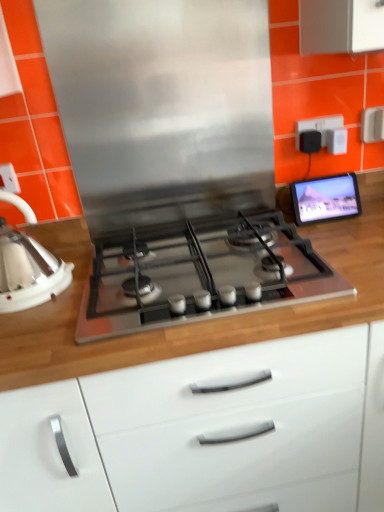
Identify the location of matte black tablet at upper right. The height and width of the screenshot is (512, 384). pos(326,199).

Measure the distance between point (x=304, y=218) and camera.

1.26 meters.

Describe the element at coordinates (191, 323) in the screenshot. I see `wooden countertop at center` at that location.

Find the location of `white glossy kettle at left`. white glossy kettle at left is located at coordinates (28, 271).

Measure the distance between point (222, 224) and camera.

Point (222, 224) and camera are 3.95 feet apart from each other.

This screenshot has height=512, width=384. What do you see at coordinates (326, 133) in the screenshot?
I see `black plastic outlet at upper right, positioned as the 1th electric outlet in back-to-front order` at bounding box center [326, 133].

At what (x,y) coordinates should I click in order to perform the action: click on white plastic electric outlet at upper left, which is the 2th electric outlet in back-to-front order. Please return your answer as a coordinate pair (x, y). Looking at the image, I should click on (9, 179).

Where is `exhaust hood behind the wooden countertop at center`? Image resolution: width=384 pixels, height=512 pixels. exhaust hood behind the wooden countertop at center is located at coordinates (162, 106).

From a real-world perspective, is wooden countertop at center physically above stainless steel exhaust hood at center?

Incorrect, from a real-world perspective, wooden countertop at center is lower than stainless steel exhaust hood at center.

Is wooden countertop at center not close to stainless steel exhaust hood at center?

No, wooden countertop at center is not far from stainless steel exhaust hood at center.

Is wooden countertop at center touching matte black tablet at upper right?

wooden countertop at center and matte black tablet at upper right are not in contact.

Is wooden countertop at center inside the boundaries of matte black tablet at upper right, or outside?

wooden countertop at center is located beyond the bounds of matte black tablet at upper right.

From the image's perspective, is wooden countertop at center beneath matte black tablet at upper right?

Yes, from the image's perspective, wooden countertop at center is beneath matte black tablet at upper right.

Based on the photo, between white plastic electric outlet at upper left, arranged as the second electric outlet when viewed from the right, and black plastic outlet at upper right, marked as the 1th electric outlet in a right-to-left arrangement, which one has smaller size?

white plastic electric outlet at upper left, arranged as the second electric outlet when viewed from the right, is smaller.

Is white plastic electric outlet at upper left, which is the 2th electric outlet in back-to-front order, far from black plastic outlet at upper right, the 2th electric outlet from the front?

They are positioned close to each other.

Is white plastic electric outlet at upper left, which is the 2th electric outlet in back-to-front order, wider or thinner than black plastic outlet at upper right, the 1th electric outlet in the top-to-bottom sequence?

Clearly, white plastic electric outlet at upper left, which is the 2th electric outlet in back-to-front order, has more width compared to black plastic outlet at upper right, the 1th electric outlet in the top-to-bottom sequence.

Consider the image. From a real-world perspective, is white plastic electric outlet at upper left, acting as the 1th electric outlet starting from the bottom, positioned above or below black plastic outlet at upper right, the 2th electric outlet from the front?

white plastic electric outlet at upper left, acting as the 1th electric outlet starting from the bottom, is above black plastic outlet at upper right, the 2th electric outlet from the front.

Locate an element on the screen. This screenshot has height=512, width=384. exhaust hood above the white plastic electric outlet at upper left, arranged as the second electric outlet when viewed from the right (from a real-world perspective) is located at coordinates (162, 106).

Is the depth of stainless steel exhaust hood at center less than that of white plastic electric outlet at upper left, arranged as the 1th electric outlet when viewed from the left?

Yes.

Would you say white plastic electric outlet at upper left, which is the 2th electric outlet in back-to-front order, is part of stainless steel exhaust hood at center's contents?

Actually, white plastic electric outlet at upper left, which is the 2th electric outlet in back-to-front order, is outside stainless steel exhaust hood at center.

From the image's perspective, which is above, stainless steel exhaust hood at center or white plastic electric outlet at upper left, arranged as the 1th electric outlet when viewed from the left?

stainless steel exhaust hood at center is shown above in the image.

Is stainless steel exhaust hood at center placed right next to stainless steel gas stove at center?

No, stainless steel exhaust hood at center is not touching stainless steel gas stove at center.

Is stainless steel exhaust hood at center facing towards stainless steel gas stove at center?

Yes, stainless steel exhaust hood at center is aimed at stainless steel gas stove at center.

From the picture: In terms of size, does stainless steel exhaust hood at center appear bigger or smaller than stainless steel gas stove at center?

stainless steel exhaust hood at center is smaller than stainless steel gas stove at center.

Considering the sizes of objects wooden countertop at center and white glossy kettle at left in the image provided, who is taller, wooden countertop at center or white glossy kettle at left?

With more height is wooden countertop at center.

From a real-world perspective, relative to white glossy kettle at left, is wooden countertop at center vertically above or below?

wooden countertop at center is below white glossy kettle at left.

Considering the points (377, 274) and (16, 300), which point is behind, point (377, 274) or point (16, 300)?

The point (16, 300) is farther from the camera.

Which is more to the right, wooden countertop at center or white glossy kettle at left?

Positioned to the right is wooden countertop at center.

Between stainless steel gas stove at center and wooden countertop at center, which one has larger size?

wooden countertop at center is bigger.

Is stainless steel gas stove at center taller than wooden countertop at center?

In fact, stainless steel gas stove at center may be shorter than wooden countertop at center.

How many degrees apart are the facing directions of stainless steel gas stove at center and wooden countertop at center?

The angular difference between stainless steel gas stove at center and wooden countertop at center is 1.35 degrees.

From the image's perspective, which is below, stainless steel gas stove at center or wooden countertop at center?

wooden countertop at center, from the image's perspective.

Locate an element on the screen. The image size is (384, 512). countertop that is below the stainless steel exhaust hood at center (from the image's perspective) is located at coordinates (191, 323).

This screenshot has width=384, height=512. Identify the location of computer monitor on the right of the wooden countertop at center. (x=326, y=199).

Looking at this image, looking at the image, which one is located further to black plastic outlet at upper right, the 1th electric outlet in the top-to-bottom sequence, stainless steel exhaust hood at center or matte black tablet at upper right?

stainless steel exhaust hood at center is further to black plastic outlet at upper right, the 1th electric outlet in the top-to-bottom sequence.

Looking at the image, which one is located further to stainless steel gas stove at center, stainless steel exhaust hood at center or black plastic outlet at upper right, positioned as the 1th electric outlet in back-to-front order?

The object further to stainless steel gas stove at center is black plastic outlet at upper right, positioned as the 1th electric outlet in back-to-front order.

Estimate the real-world distances between objects in this image. Which object is further from stainless steel gas stove at center, wooden countertop at center or black plastic outlet at upper right, the 1th electric outlet in the top-to-bottom sequence?

black plastic outlet at upper right, the 1th electric outlet in the top-to-bottom sequence, lies further to stainless steel gas stove at center than the other object.

Which object lies further to the anchor point white glossy kettle at left, wooden countertop at center or matte black tablet at upper right?

Based on the image, matte black tablet at upper right appears to be further to white glossy kettle at left.

Considering their positions, is stainless steel gas stove at center positioned further to white plastic electric outlet at upper left, which is the 2th electric outlet in back-to-front order, than white glossy kettle at left?

stainless steel gas stove at center is positioned further to the anchor white plastic electric outlet at upper left, which is the 2th electric outlet in back-to-front order.

Considering their positions, is stainless steel gas stove at center positioned further to wooden countertop at center than white glossy kettle at left?

white glossy kettle at left.

Which object lies further to the anchor point black plastic outlet at upper right, marked as the 1th electric outlet in a right-to-left arrangement, matte black tablet at upper right or white plastic electric outlet at upper left, arranged as the 1th electric outlet when viewed from the left?

Among the two, white plastic electric outlet at upper left, arranged as the 1th electric outlet when viewed from the left, is located further to black plastic outlet at upper right, marked as the 1th electric outlet in a right-to-left arrangement.

Estimate the real-world distances between objects in this image. Which object is further from stainless steel gas stove at center, white glossy kettle at left or black plastic outlet at upper right, the 2th electric outlet from the front?

black plastic outlet at upper right, the 2th electric outlet from the front, is further to stainless steel gas stove at center.

Find the location of a particular element. gas stove located between white plastic electric outlet at upper left, the 1th electric outlet from the front, and black plastic outlet at upper right, positioned as the 1th electric outlet in back-to-front order, in the left-right direction is located at coordinates (200, 273).

You are a GUI agent. You are given a task and a screenshot of the screen. Output one action in this format:
    pyautogui.click(x=<x>, y=<y>)
    Task: Click on the kitchen appliance between stainless steel exhaust hood at center and wooden countertop at center in the vertical direction
    The width and height of the screenshot is (384, 512).
    Given the screenshot: What is the action you would take?
    pyautogui.click(x=28, y=271)

Where is `gas stove between black plastic outlet at upper right, the second electric outlet from the left, and wooden countertop at center, in the vertical direction`? The width and height of the screenshot is (384, 512). gas stove between black plastic outlet at upper right, the second electric outlet from the left, and wooden countertop at center, in the vertical direction is located at coordinates (200, 273).

Locate an element on the screen. This screenshot has width=384, height=512. kitchen appliance located between white plastic electric outlet at upper left, acting as the 1th electric outlet starting from the bottom, and stainless steel gas stove at center in the left-right direction is located at coordinates (28, 271).